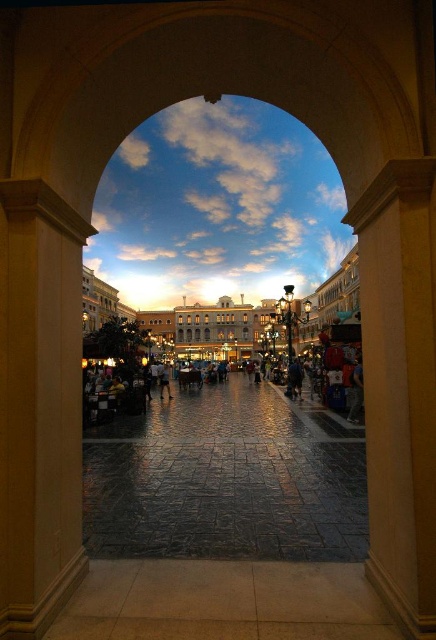
Question: Considering the real-world distances, which object is farthest from the beige stone pillar at right?

Choices:
 (A) dark blue jeans at center
 (B) smooth beige column at left

Answer: (A)

Question: Can you confirm if smooth beige column at left is wider than dark blue jeans at center?

Choices:
 (A) yes
 (B) no

Answer: (B)

Question: Which point is closer to the camera?

Choices:
 (A) (170, 397)
 (B) (24, 515)

Answer: (B)

Question: Observing the image, what is the correct spatial positioning of beige stone pillar at right in reference to dark blue jeans at center?

Choices:
 (A) left
 (B) right

Answer: (B)

Question: Among these points, which one is farthest from the camera?

Choices:
 (A) (74, 499)
 (B) (163, 388)
 (C) (388, 392)

Answer: (B)

Question: Is smooth beige column at left closer to the viewer compared to beige stone pillar at right?

Choices:
 (A) yes
 (B) no

Answer: (B)